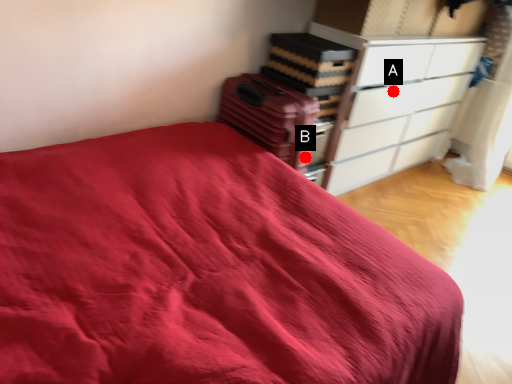
Question: Two points are circled on the image, labeled by A and B beside each circle. Which point is farther from the camera taking this photo?

Choices:
 (A) A is further
 (B) B is further

Answer: (A)